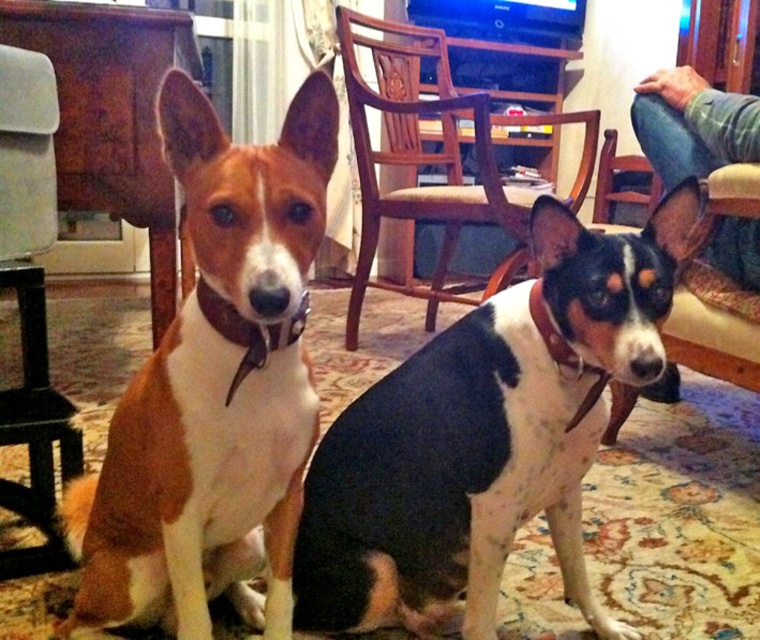
Looking at this image, is black and white fur at center wider than brown leather collar at center?

A: Yes, black and white fur at center is wider than brown leather collar at center.

In the scene shown: Between black and white fur at center and brown leather collar at center, which one appears on the left side from the viewer's perspective?

Positioned to the left is black and white fur at center.

This screenshot has height=640, width=760. I want to click on black and white fur at center, so click(485, 436).

Is brown and white fur at center bigger than brown leather collar at center?

Indeed, brown and white fur at center has a larger size compared to brown leather collar at center.

Between brown and white fur at center and brown leather collar at center, which one has more height?

brown and white fur at center is taller.

The width and height of the screenshot is (760, 640). Describe the element at coordinates (214, 390) in the screenshot. I see `brown and white fur at center` at that location.

Where is `brown and white fur at center`? The height and width of the screenshot is (640, 760). brown and white fur at center is located at coordinates (214, 390).

Between black and white fur at center and wooden chair at center, which one appears on the left side from the viewer's perspective?

wooden chair at center is more to the left.

Which is above, black and white fur at center or wooden chair at center?

wooden chair at center is higher up.

Does point (675, 232) come closer to viewer compared to point (442, 253)?

Yes.

You are a GUI agent. You are given a task and a screenshot of the screen. Output one action in this format:
    pyautogui.click(x=<x>, y=<y>)
    Task: Click on the black and white fur at center
    The image size is (760, 640).
    Given the screenshot: What is the action you would take?
    pyautogui.click(x=485, y=436)